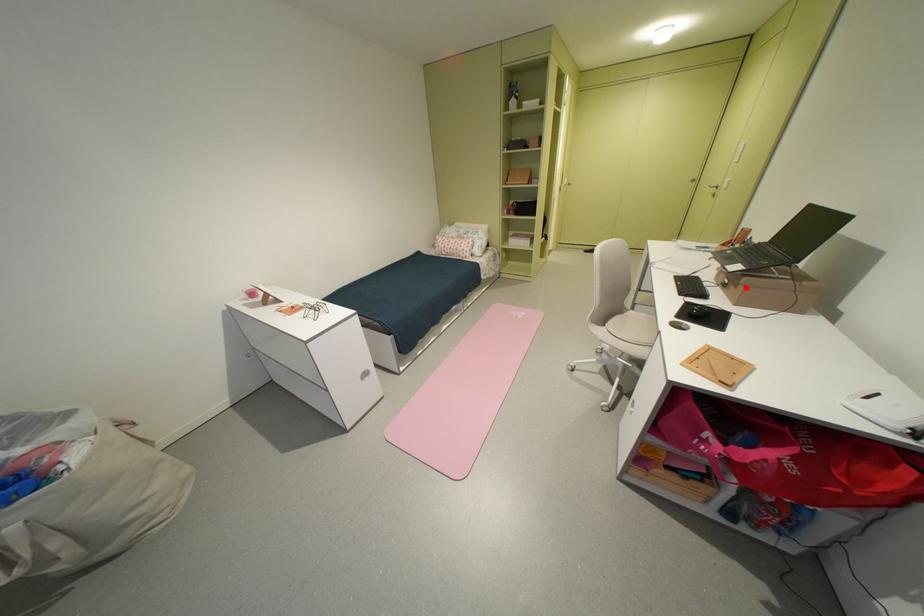
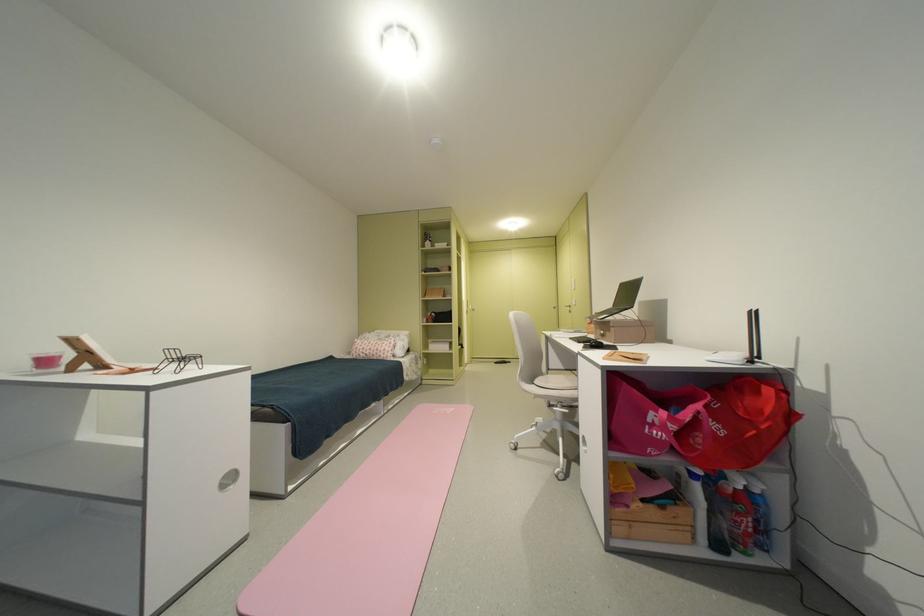
The point at the highlighted location is marked in the first image. Where is the corresponding point in the second image?

(618, 331)